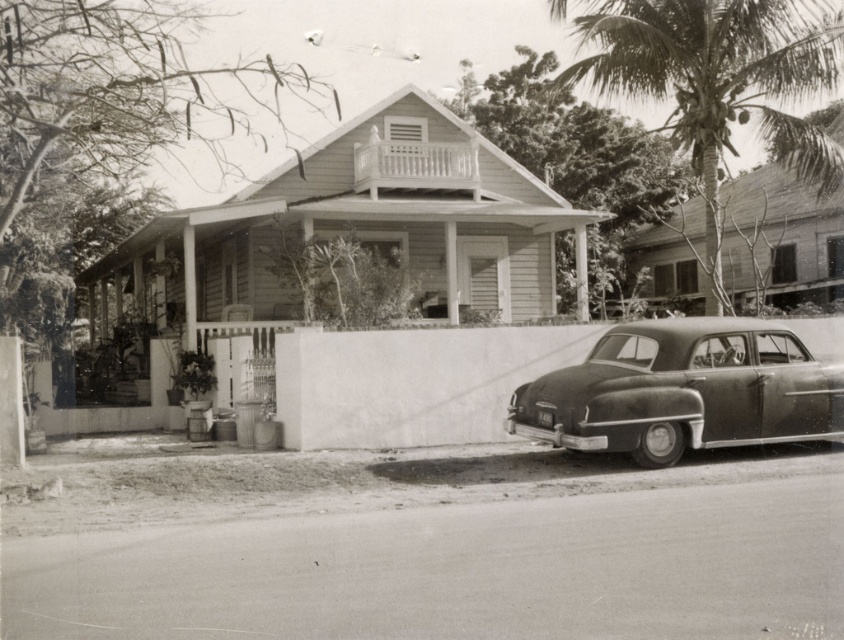
Question: Is coarse textured palm tree at upper right thinner than shiny black sedan at lower right?

Choices:
 (A) yes
 (B) no

Answer: (B)

Question: Which point is closer to the camera?

Choices:
 (A) shiny black sedan at lower right
 (B) coarse textured palm tree at upper right

Answer: (A)

Question: Which point is farther to the camera?

Choices:
 (A) (668, 17)
 (B) (566, 410)
 (C) (475, 168)

Answer: (C)

Question: Which point is closer to the camera taking this photo?

Choices:
 (A) (426, 147)
 (B) (688, 433)
 (C) (602, 22)

Answer: (B)

Question: Is shiny black sedan at lower right positioned in front of white wooden porch at upper center?

Choices:
 (A) yes
 (B) no

Answer: (A)

Question: Is coarse textured palm tree at upper right positioned at the back of white wooden porch at upper center?

Choices:
 (A) no
 (B) yes

Answer: (A)